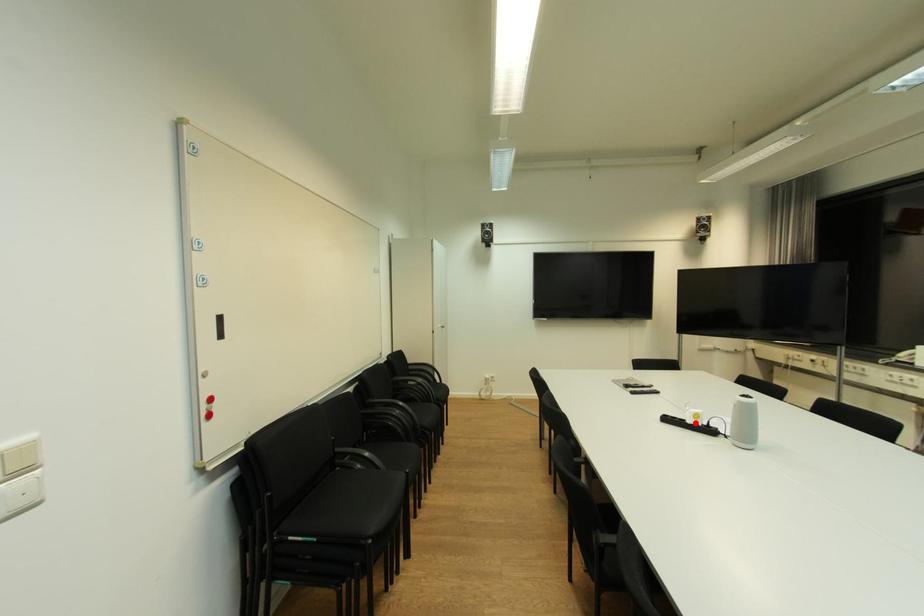
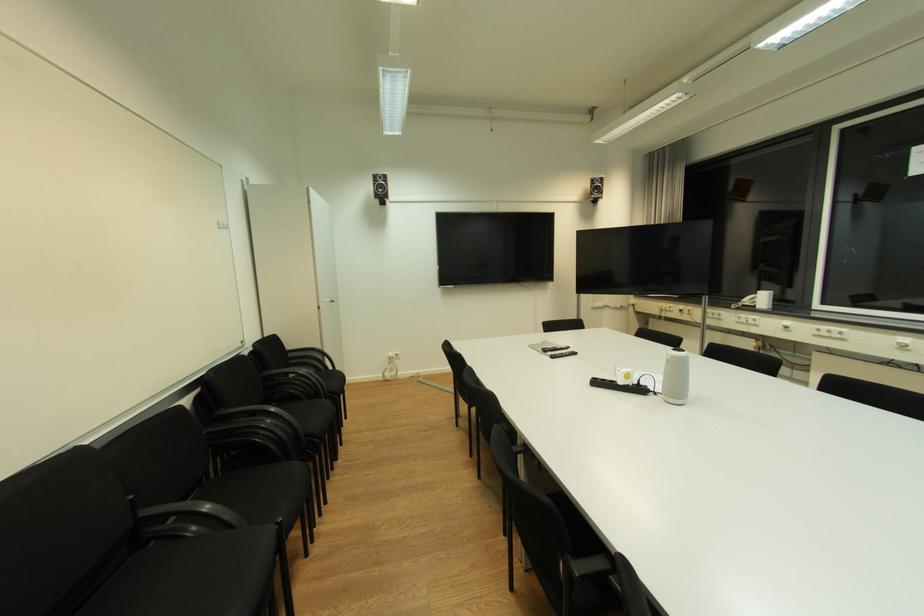
Find the pixel in the second image that matches the highlighted location in the first image.

(626, 384)